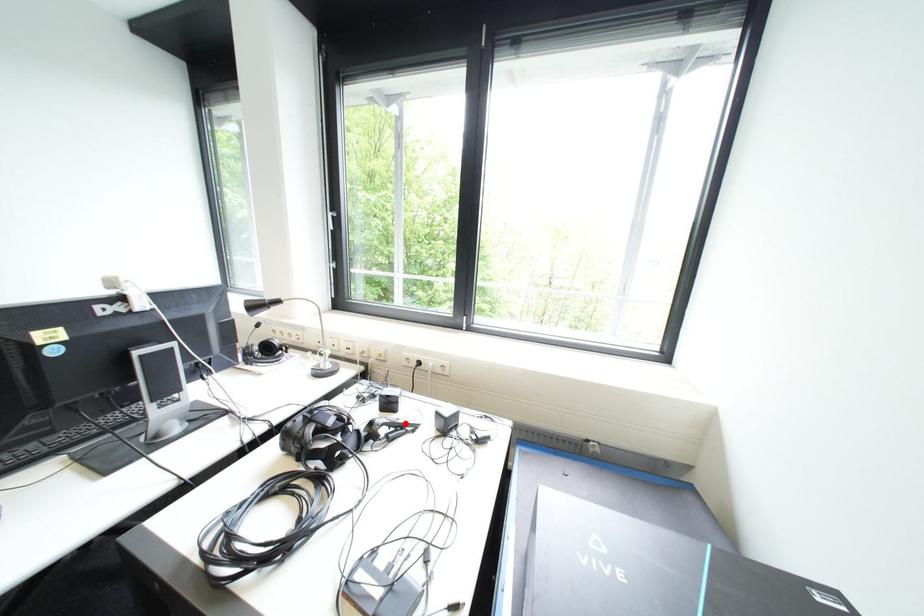
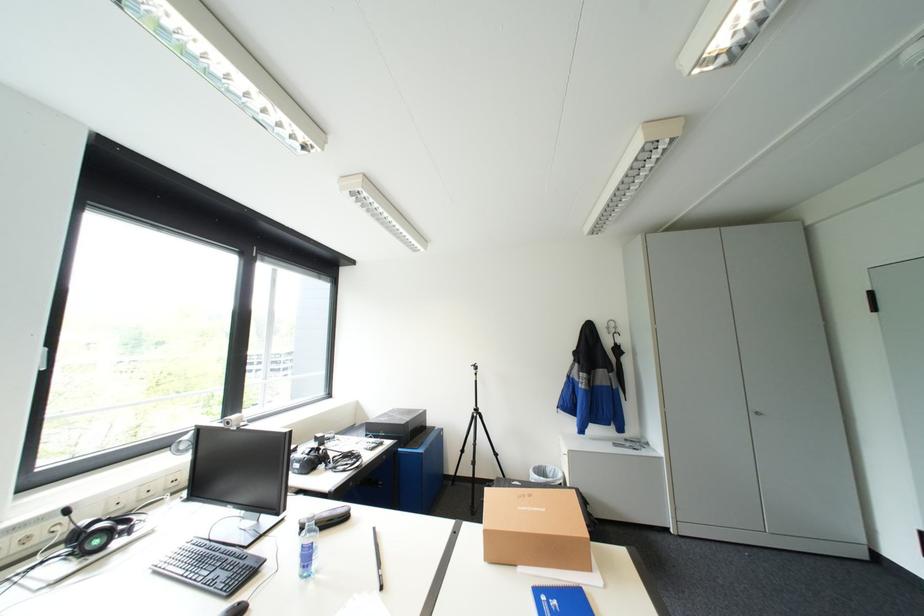
Question: I am providing you with two images of the same scene from different viewpoints. A red point is marked on the first image. Is the red point's position out of view in image 2?

Choices:
 (A) Yes
 (B) No

Answer: (A)